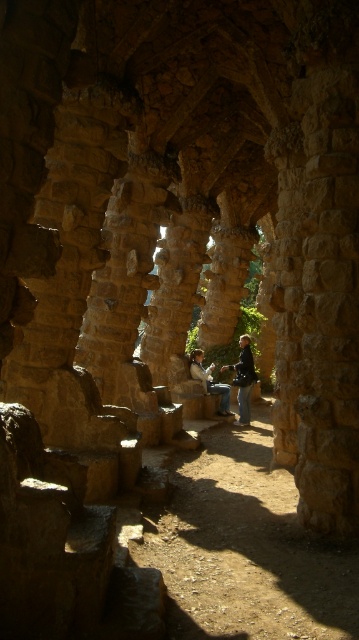
Does point (245, 340) come behind point (201, 371)?

That is True.

Is dark gray fabric jacket at center positioned in front of matte brown hair at center?

No, it is behind matte brown hair at center.

Is point (244, 403) positioned behind point (194, 353)?

Yes, it is behind point (194, 353).

Find the location of a particular element. This screenshot has width=359, height=640. dark gray fabric jacket at center is located at coordinates (244, 380).